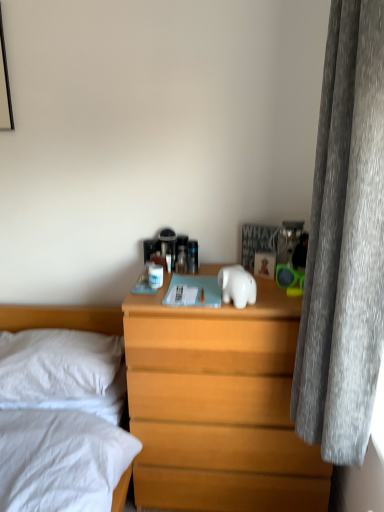
This screenshot has width=384, height=512. What are the coordinates of `blank space situated above wooden nightstand at center (from a real-world perspective)` in the screenshot? It's located at (213, 289).